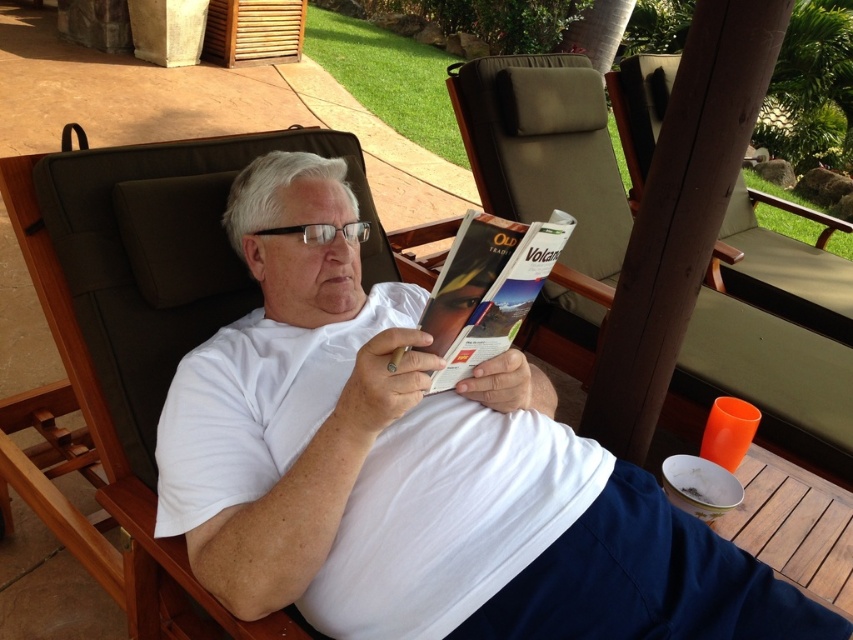
You are designing a new layout for a cozy reading nook and need to place both the brown fabric rocking chair at center and the matte paper magazine at center. If you want to arrange them side by side without overlapping, which object should be placed first to ensure there is enough space?

The brown fabric rocking chair at center should be placed first since it is wider than the matte paper magazine at center, ensuring there is enough space when arranging them side by side.

You are a delivery person who needs to place a small package on the surface where the matte paper magazine at center is located. Can you confirm if the brown fabric rocking chair at center will block access to that surface?

The brown fabric rocking chair at center has a greater height than the matte paper magazine at center. Since the chair is taller, it might block access to the surface where the magazine is placed. You may need to move the chair or adjust its position to place the package there safely.